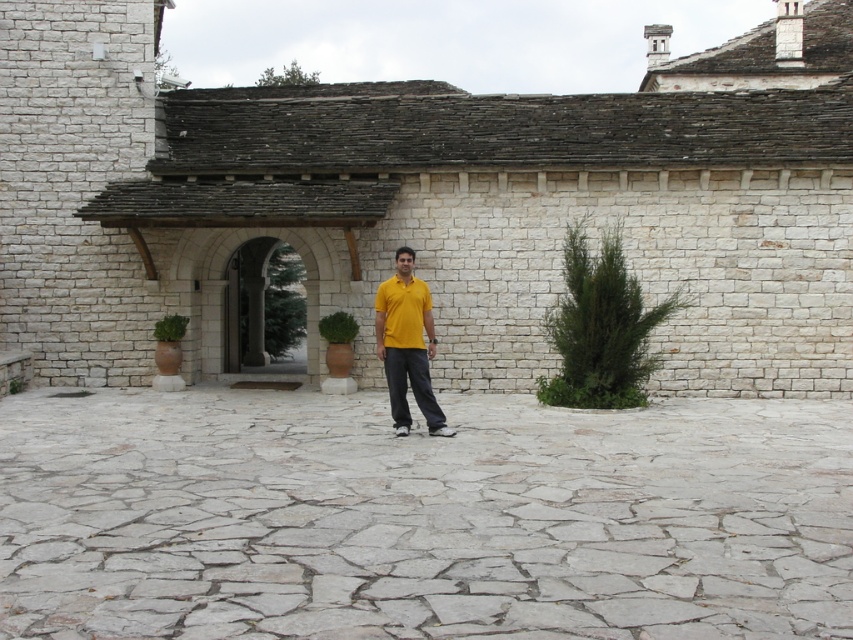
You are a photographer planning to capture the man in his yellow matte shirt at center and the gray stone courtyard at center. Based on their heights, which one should you focus on to ensure it appears larger in the photo?

The yellow matte shirt at center is taller than the gray stone courtyard at center, so focusing on it will make it appear larger in the photo.

You are a photographer trying to capture the man in the yellow matte shirt at center while ensuring the gray stone courtyard at center is visible in the background. Based on their positions, will you need to adjust your camera angle to include both the man and the courtyard in the frame?

The gray stone courtyard at center is in front of the yellow matte shirt at center, so the courtyard is closer to the camera. To capture both the man and the courtyard in the frame, you would need to adjust your camera angle to ensure the yellow matte shirt at center is in the foreground and the gray stone courtyard at center is visible in the background.